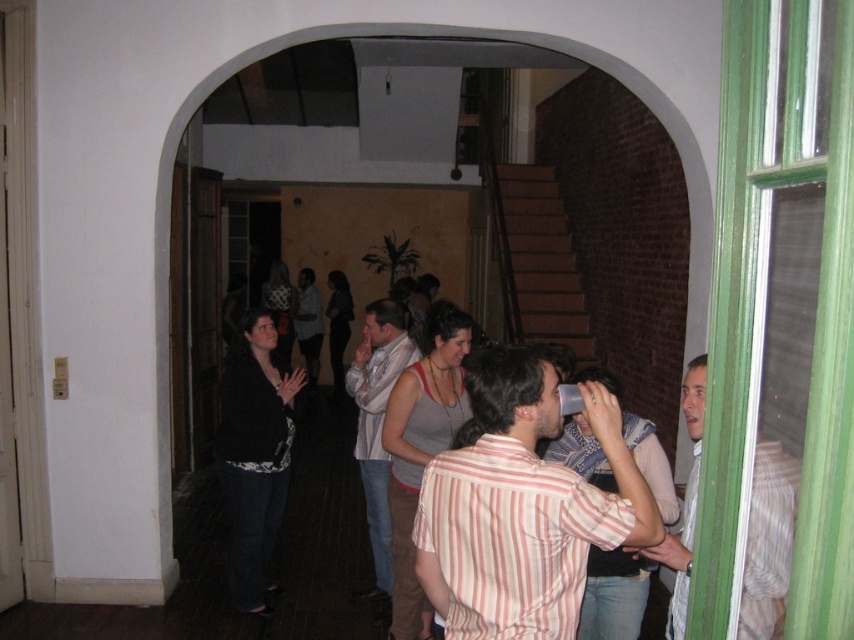
You are a photographer at the event and want to take a photo of both the striped cotton shirt at center and the light gray scarf at center. However, you need to ensure that both are fully visible in the frame. Based on their positions, which object should you focus on to make sure both are in focus?

You should focus on the striped cotton shirt at center because it is in front of the light gray scarf at center, so focusing on the closer object will ensure both are in focus.

You are standing in the historic building and want to greet both the person wearing the striped cotton shirt at center and the person wearing the light brown striped shirt at right. Which person should you approach first to reach them more quickly?

You should approach the striped cotton shirt at center first because it is closer to you than the light brown striped shirt at right, which is further away.

You are standing at the entrance of the room through the arched doorway and want to find the striped cotton shirt at center. According to the coordinates, in which direction should you look to locate it?

The striped cotton shirt at center is located at coordinates point (522, 508), which means it is positioned towards the lower right of the room from your entrance perspective.